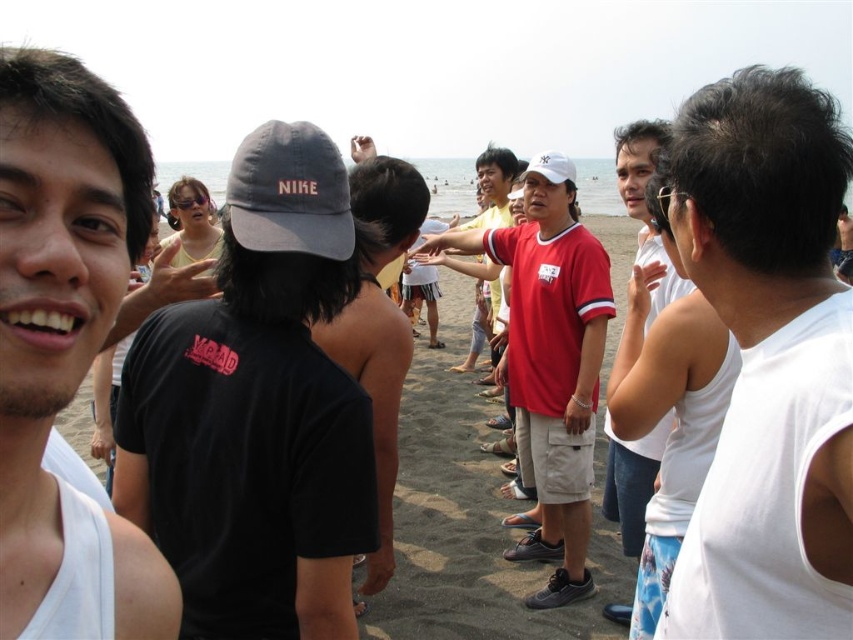
From the picture: You are a photographer trying to capture a group photo of the white matte tank top at center and the red matte shirt at center. Based on their sizes, which one should you focus on to ensure both are in frame without cropping?

The white matte tank top at center is smaller than the red matte shirt at center, so you should focus on the red matte shirt at center to ensure both are in frame without cropping.

You are a photographer trying to capture the group activity. You notice the white tank top at right and the red matte shirt at center. Which one is covering part of the other?

The white tank top at right is positioned over the red matte shirt at center, so it is covering part of it.

You are a photographer trying to capture a group photo of the white tank top at right and the red matte shirt at center. Which clothing item will appear smaller in the photo?

The white tank top at right will appear smaller in the photo because it is shorter than the red matte shirt at center.